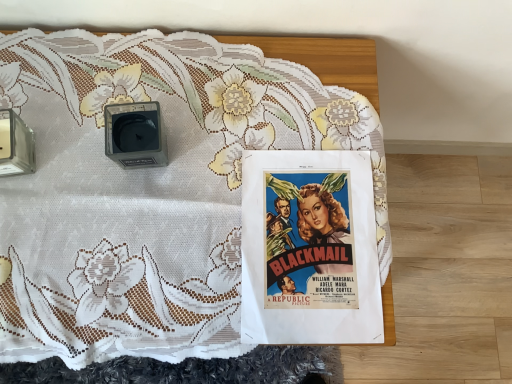
The width and height of the screenshot is (512, 384). I want to click on free space that is in between matte black alarm clock at upper left and vivid paper poster at center, so click(208, 201).